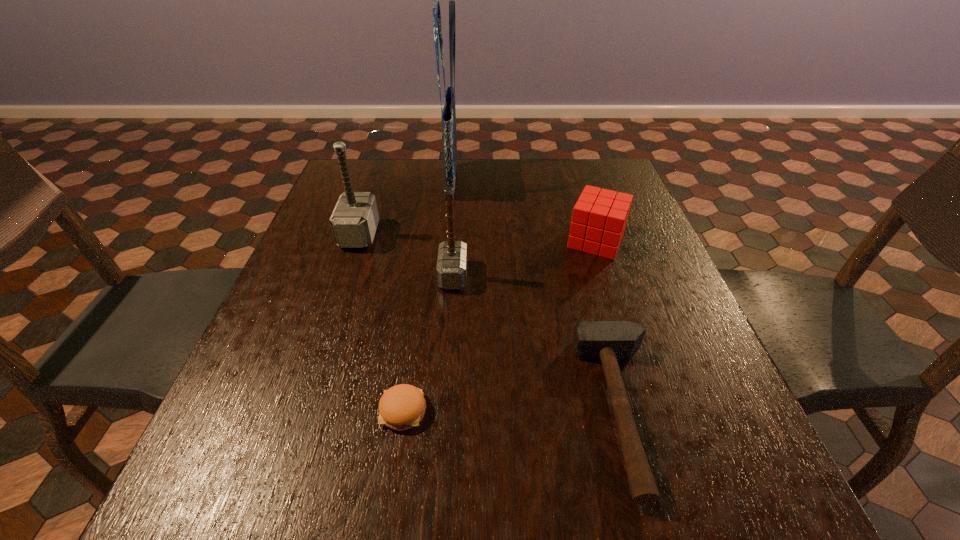
Find the location of a particular element. The image size is (960, 540). cube positioned at the right edge is located at coordinates (599, 218).

The width and height of the screenshot is (960, 540). What are the coordinates of `hammer located in the right edge section of the desktop` in the screenshot? It's located at (608, 341).

Locate an element on the screen. The height and width of the screenshot is (540, 960). object that is positioned at the near right corner is located at coordinates (608, 341).

Image resolution: width=960 pixels, height=540 pixels. Find the location of `vacant space at the far edge of the desktop`. vacant space at the far edge of the desktop is located at coordinates (466, 180).

In order to click on blank space at the left edge of the desktop in this screenshot , I will do pyautogui.click(x=239, y=386).

The width and height of the screenshot is (960, 540). I want to click on free region at the right edge, so tap(611, 260).

Identify the location of free space at the far left corner of the desktop. (387, 186).

You are a GUI agent. You are given a task and a screenshot of the screen. Output one action in this format:
    pyautogui.click(x=<x>, y=<y>)
    Task: Click on the vacant region at the far right corner
    
    Given the screenshot: What is the action you would take?
    pyautogui.click(x=576, y=185)

I want to click on free space that is in between the leftmost hammer and the second nearest hammer, so (x=406, y=255).

Locate an element on the screen. The height and width of the screenshot is (540, 960). free spot between the shopping bag and the shortest object is located at coordinates (427, 296).